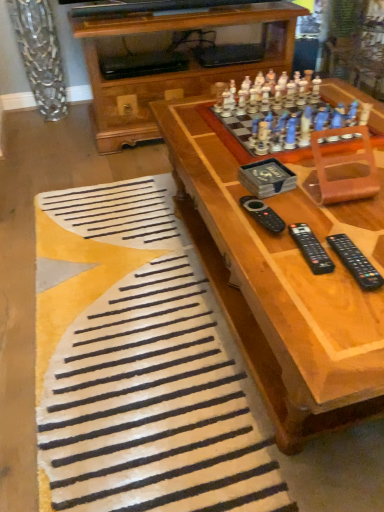
Identify the location of vacant space behind black plastic remote at center, arranged as the 3th remote when viewed from the right. (240, 179).